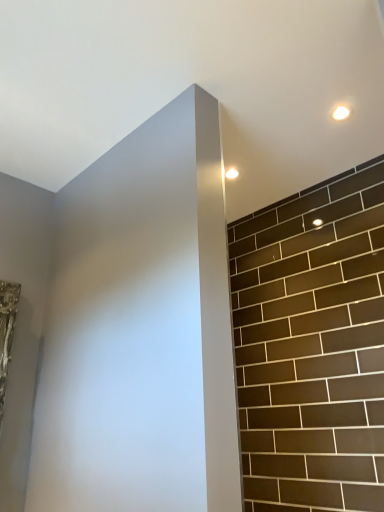
Describe the element at coordinates (231, 173) in the screenshot. I see `matte white light fixture at upper right` at that location.

Where is `matte white light fixture at upper right`? matte white light fixture at upper right is located at coordinates (231, 173).

What are the coordinates of `matte white light fixture at upper right` in the screenshot? It's located at coord(231,173).